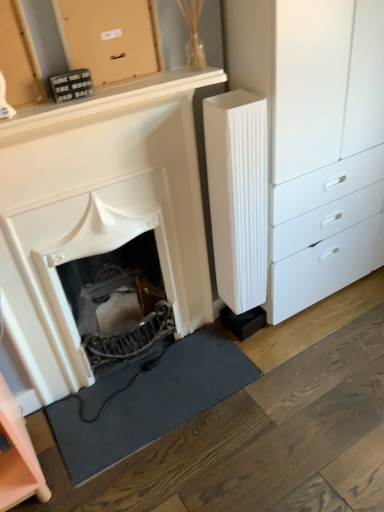
Where is `vacant area that is situated to the right of black rubber doormat at lower left`? Image resolution: width=384 pixels, height=512 pixels. vacant area that is situated to the right of black rubber doormat at lower left is located at coordinates (291, 400).